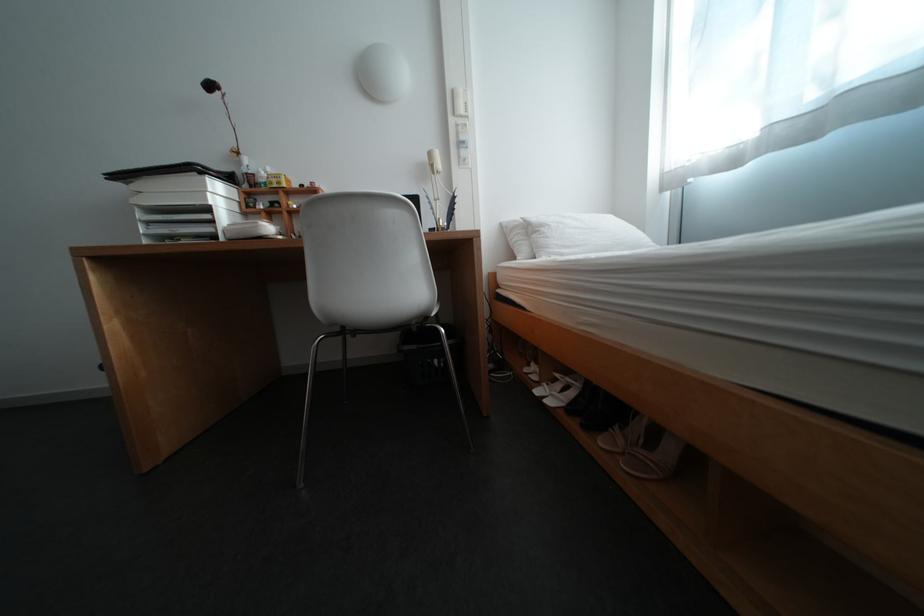
Where would you press the wall switch panel? Please return your answer as a coordinate pair (x, y).

(459, 102)